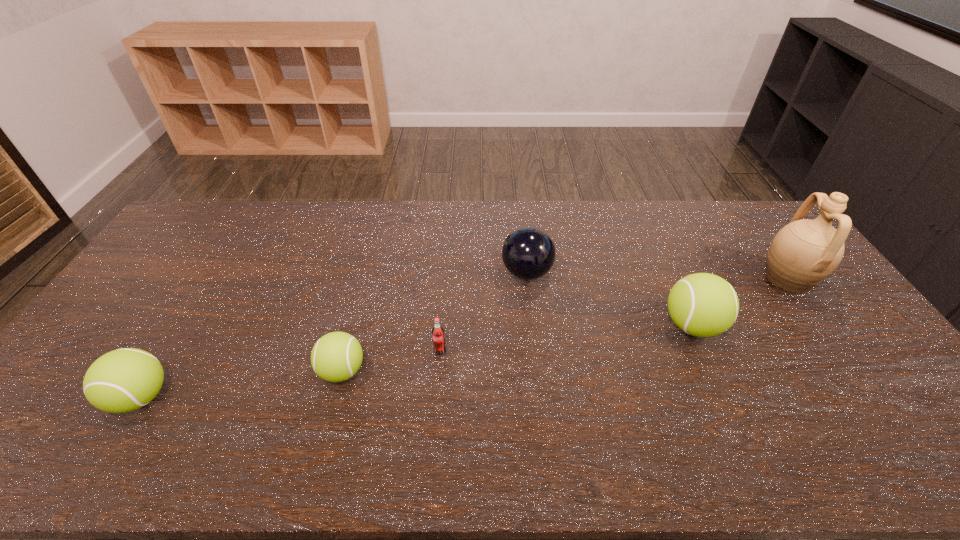
Find the location of a particular element. The width and height of the screenshot is (960, 540). vacant region located on the back of the second shortest tennis ball is located at coordinates (212, 283).

Find the location of a particular element. The image size is (960, 540). free space located 0.180m on the left of the second object from left to right is located at coordinates (250, 371).

Find the location of `free spot located on the back of the farthest tennis ball`. free spot located on the back of the farthest tennis ball is located at coordinates (661, 257).

This screenshot has width=960, height=540. I want to click on vacant space situated on the side of the bowling ball with the finger holes, so click(390, 273).

Identify the location of vacant region located 0.100m on the side of the bowling ball with the finger holes. (470, 273).

What are the coordinates of `vacant space located on the side of the bowling ball with the finger holes` in the screenshot? It's located at (461, 273).

Find the location of a particular element. This screenshot has height=540, width=960. vacant space located on the left of the pitcher is located at coordinates (700, 278).

Locate an element on the screen. This screenshot has width=960, height=540. free region located 0.180m on the label of the third object from left to right is located at coordinates (435, 418).

At what (x,y) coordinates should I click in order to perform the action: click on object at the left edge. Please return your answer as a coordinate pair (x, y). Looking at the image, I should click on (123, 380).

Where is `object present at the right edge`? object present at the right edge is located at coordinates (804, 252).